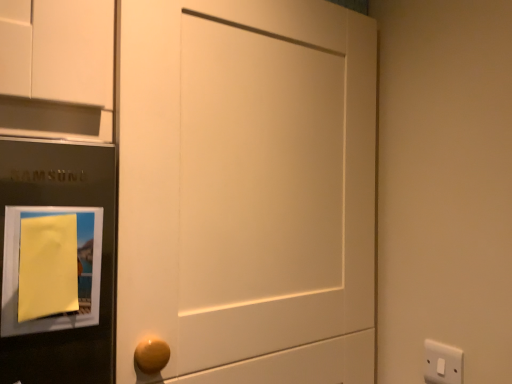
Question: In the image, is yellow matte paper at left positioned in front of or behind white plastic light switch at lower right?

Choices:
 (A) behind
 (B) front

Answer: (B)

Question: In terms of height, does yellow matte paper at left look taller or shorter compared to white plastic light switch at lower right?

Choices:
 (A) short
 (B) tall

Answer: (B)

Question: From a real-world perspective, is yellow matte paper at left positioned above or below white plastic light switch at lower right?

Choices:
 (A) below
 (B) above

Answer: (B)

Question: Is point (433, 382) closer or farther from the camera than point (66, 291)?

Choices:
 (A) farther
 (B) closer

Answer: (A)

Question: Looking at their shapes, would you say white plastic light switch at lower right is wider or thinner than yellow matte paper at left?

Choices:
 (A) thin
 (B) wide

Answer: (A)

Question: From the image's perspective, is white plastic light switch at lower right positioned above or below yellow matte paper at left?

Choices:
 (A) below
 (B) above

Answer: (A)

Question: In the image, is white plastic light switch at lower right positioned in front of or behind yellow matte paper at left?

Choices:
 (A) front
 (B) behind

Answer: (B)